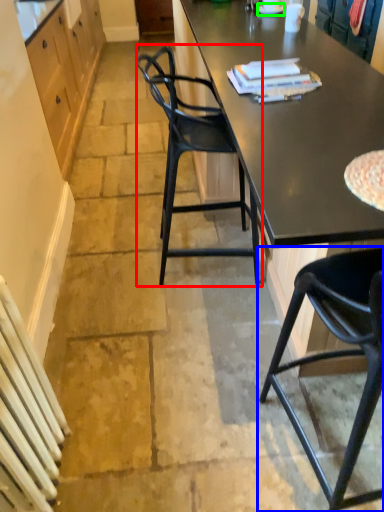
Question: Based on their relative distances, which object is farther from chair (highlighted by a red box)? Choose from chair (highlighted by a blue box) and plate (highlighted by a green box).

Choices:
 (A) chair
 (B) plate

Answer: (B)